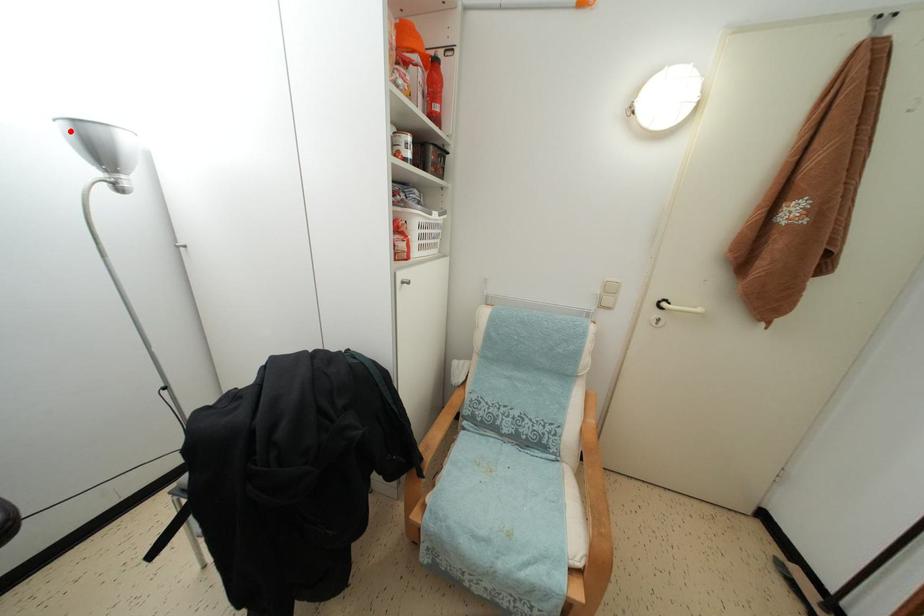
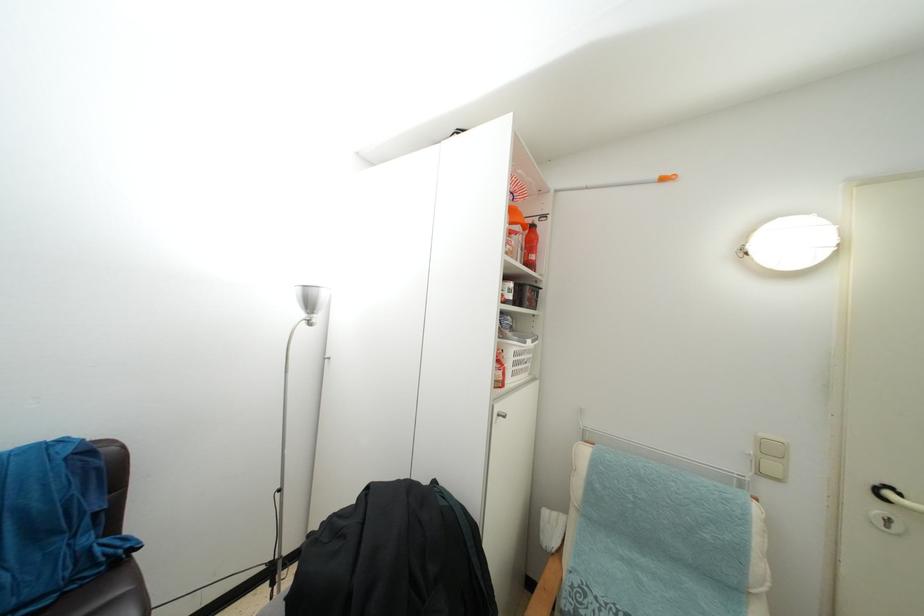
Question: I am providing you with two images of the same scene from different viewpoints. A red point is marked on the first image. Is the red point's position out of view in image 2?

Choices:
 (A) Yes
 (B) No

Answer: (B)